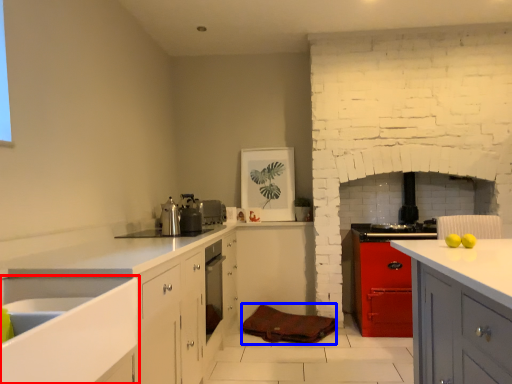
Question: Which of the following is the farthest to the observer, sink (highlighted by a red box) or material (highlighted by a blue box)?

Choices:
 (A) sink
 (B) material

Answer: (B)